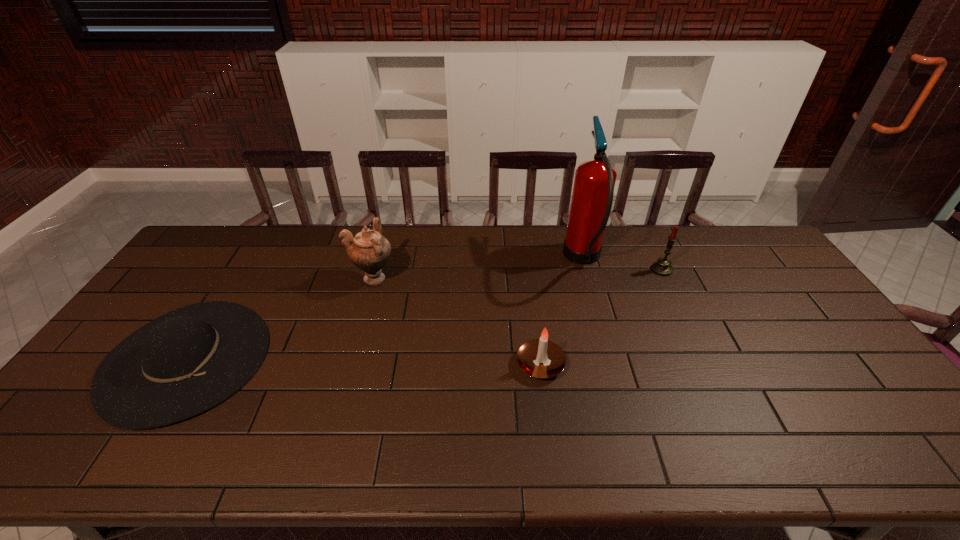
This screenshot has width=960, height=540. In order to click on vacant space situated 0.250m on the front of the urn in this screenshot , I will do `click(352, 356)`.

Where is `free region located on the left of the farther candle`? The width and height of the screenshot is (960, 540). free region located on the left of the farther candle is located at coordinates (556, 269).

This screenshot has width=960, height=540. What are the coordinates of `free location located 0.290m on the back of the left candle` in the screenshot? It's located at (529, 276).

You are a GUI agent. You are given a task and a screenshot of the screen. Output one action in this format:
    pyautogui.click(x=<x>, y=<y>)
    Task: Click on the fire extinguisher present at the far edge
    This screenshot has width=960, height=540.
    Given the screenshot: What is the action you would take?
    pyautogui.click(x=593, y=190)

At what (x,y) coordinates should I click in order to perform the action: click on urn that is at the far edge. Please return your answer as a coordinate pair (x, y). This screenshot has height=540, width=960. Looking at the image, I should click on (369, 251).

Identify the location of candle situated at the far edge. The height and width of the screenshot is (540, 960). (662, 267).

Image resolution: width=960 pixels, height=540 pixels. What are the coordinates of `object that is at the near edge` in the screenshot? It's located at (183, 363).

Locate an element on the screen. object present at the left edge is located at coordinates (183, 363).

At what (x,y) coordinates should I click in order to perform the action: click on object located at the near left corner. Please return your answer as a coordinate pair (x, y). This screenshot has width=960, height=540. Looking at the image, I should click on (183, 363).

In the image, there is a desktop. Where is `vacant space at the far edge`? vacant space at the far edge is located at coordinates (249, 240).